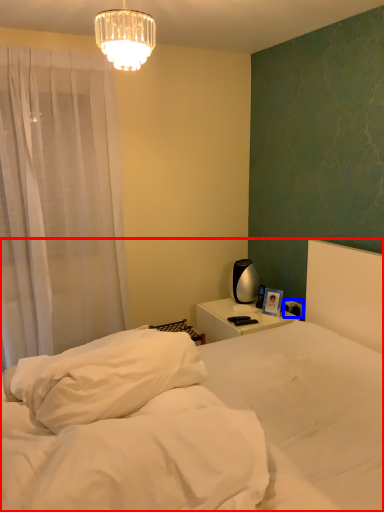
Question: Among these objects, which one is farthest to the camera, bed (highlighted by a red box) or electric outlet (highlighted by a blue box)?

Choices:
 (A) bed
 (B) electric outlet

Answer: (B)